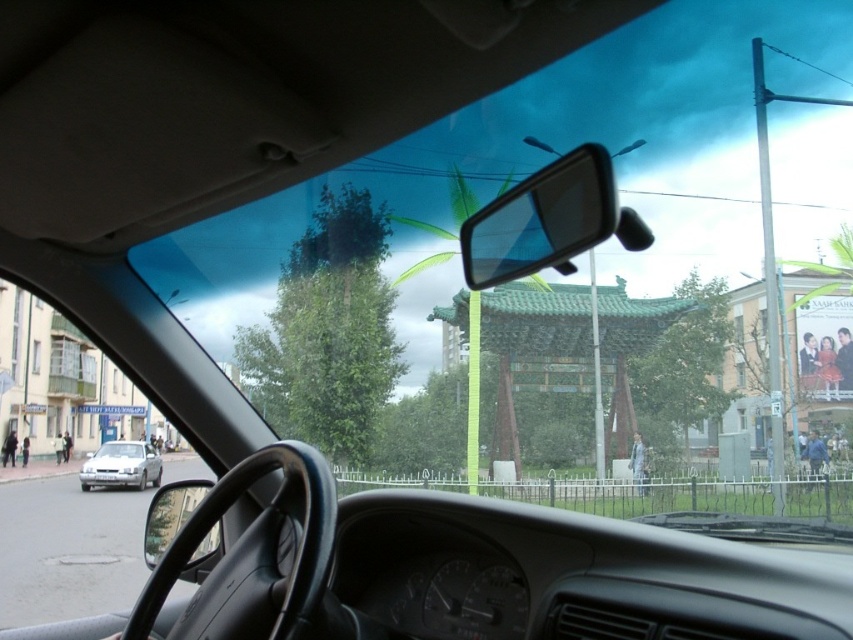
You are driving a car and notice two objects in your view. One is a clear plastic mirror at upper center and the other is a silver metallic sedan at lower left. Which object appears smaller in your view?

The clear plastic mirror at upper center appears smaller in your view because it has a smaller size compared to the silver metallic sedan at lower left.

You are driving a car and want to check your rearview mirror to see if there is a vehicle behind you. The clear plastic mirror at upper center is your rearview mirror. Can you see the silver metallic sedan at lower left in your rearview mirror?

The clear plastic mirror at upper center has a smaller width than the silver metallic sedan at lower left, so it is possible that the silver metallic sedan at lower left cannot be fully seen in the mirror. However, whether it is visible depends on the positioning and angle of the mirror.

You are driving a car and need to check if there is enough space to safely pass between the clear plastic mirror at upper center and the silver metallic sedan at lower left. According to the scene description, what is the minimum distance you should maintain between your car and these two objects to ensure safety?

The clear plastic mirror at upper center and the silver metallic sedan at lower left are 93.24 feet apart. To ensure safety, you should maintain a distance of at least 2 feet from each object, totaling a minimum of 97.24 feet between your car and both objects.